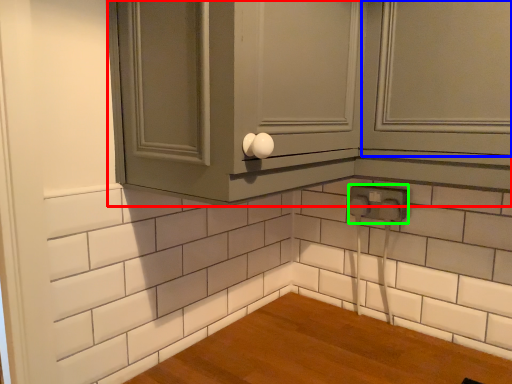
Question: Which object is the closest to the cabinetry (highlighted by a red box)? Choose among these: window (highlighted by a blue box) or electric outlet (highlighted by a green box).

Choices:
 (A) window
 (B) electric outlet

Answer: (A)